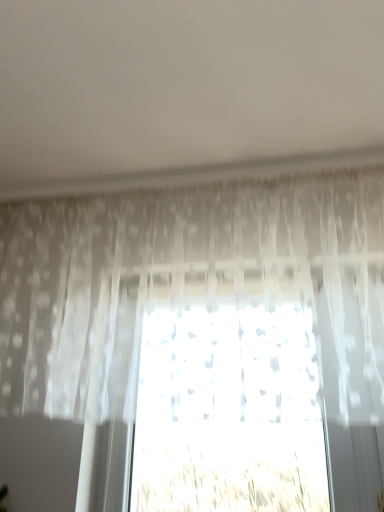
The image size is (384, 512). What do you see at coordinates (188, 283) in the screenshot?
I see `translucent white curtain at center` at bounding box center [188, 283].

You are a GUI agent. You are given a task and a screenshot of the screen. Output one action in this format:
    pyautogui.click(x=<x>, y=<y>)
    Task: Click on the translucent white curtain at center
    This screenshot has height=512, width=384.
    Given the screenshot: What is the action you would take?
    (188, 283)

Measure the distance between translucent fabric plant at center and camera.

translucent fabric plant at center and camera are 3.92 feet apart.

The image size is (384, 512). Find the location of `translucent fabric plant at center`. translucent fabric plant at center is located at coordinates (232, 475).

The height and width of the screenshot is (512, 384). Describe the element at coordinates (232, 475) in the screenshot. I see `translucent fabric plant at center` at that location.

Locate an element on the screen. This screenshot has width=384, height=512. translucent white curtain at center is located at coordinates (188, 283).

Is translucent fabric plant at center to the right of translucent white curtain at center from the viewer's perspective?

Indeed, translucent fabric plant at center is positioned on the right side of translucent white curtain at center.

Is the depth of translucent fabric plant at center less than that of translucent white curtain at center?

No, it is not.

Does point (159, 489) lie behind point (294, 259)?

That is True.

Looking at this image, from the image's perspective, between translucent fabric plant at center and translucent white curtain at center, who is located below?

From the image's view, translucent fabric plant at center is below.

From a real-world perspective, who is located higher, translucent fabric plant at center or translucent white curtain at center?

From a 3D spatial view, translucent white curtain at center is above.

Considering the sizes of translucent fabric plant at center and translucent white curtain at center in the image, is translucent fabric plant at center wider or thinner than translucent white curtain at center?

Considering their sizes, translucent fabric plant at center looks slimmer than translucent white curtain at center.

Between translucent fabric plant at center and translucent white curtain at center, which one has more height?

With more height is translucent white curtain at center.

Considering the relative sizes of translucent fabric plant at center and translucent white curtain at center in the image provided, is translucent fabric plant at center smaller than translucent white curtain at center?

Indeed, translucent fabric plant at center has a smaller size compared to translucent white curtain at center.

Is translucent fabric plant at center inside or outside of translucent white curtain at center?

translucent fabric plant at center exists outside the volume of translucent white curtain at center.

Is translucent fabric plant at center far from translucent white curtain at center?

That's not correct — translucent fabric plant at center is a little close to translucent white curtain at center.

In the scene shown: Could you tell me if translucent fabric plant at center is facing translucent white curtain at center?

No, translucent fabric plant at center is not oriented towards translucent white curtain at center.

You are a GUI agent. You are given a task and a screenshot of the screen. Output one action in this format:
    pyautogui.click(x=<x>, y=<y>)
    Task: Click on the curtain above the translucent fabric plant at center (from the image's perspective)
    
    Given the screenshot: What is the action you would take?
    point(188,283)

Which is more to the right, translucent white curtain at center or translucent fabric plant at center?

translucent fabric plant at center.

Between translucent white curtain at center and translucent fabric plant at center, which one is positioned in front?

translucent white curtain at center is in front.

Is point (105, 341) in front of point (299, 500)?

No, (105, 341) is further to viewer.

From the image's perspective, who appears lower, translucent white curtain at center or translucent fabric plant at center?

translucent fabric plant at center appears lower in the image.

From a real-world perspective, is translucent white curtain at center above or below translucent fabric plant at center?

In terms of real-world spatial position, translucent white curtain at center is above translucent fabric plant at center.

Considering the sizes of translucent white curtain at center and translucent fabric plant at center in the image, is translucent white curtain at center wider or thinner than translucent fabric plant at center?

translucent white curtain at center is wider than translucent fabric plant at center.

From the picture: Is translucent white curtain at center taller than translucent fabric plant at center?

Yes.

Based on their sizes in the image, would you say translucent white curtain at center is bigger or smaller than translucent fabric plant at center?

Considering their sizes, translucent white curtain at center takes up more space than translucent fabric plant at center.

In the scene shown: Would you say translucent white curtain at center is inside or outside translucent fabric plant at center?

translucent white curtain at center is located beyond the bounds of translucent fabric plant at center.

Consider the image. Would you say translucent white curtain at center is a long distance from translucent fabric plant at center?

translucent white curtain at center is near translucent fabric plant at center, not far away.

Is translucent white curtain at center looking in the opposite direction of translucent fabric plant at center?

No, translucent white curtain at center is not facing the opposite direction of translucent fabric plant at center.

What's the angular difference between translucent white curtain at center and translucent fabric plant at center's facing directions?

They differ by 0.00207 degrees in their facing directions.

The width and height of the screenshot is (384, 512). In order to click on curtain that is above the translucent fabric plant at center (from the image's perspective) in this screenshot , I will do `click(188, 283)`.

At what (x,y) coordinates should I click in order to perform the action: click on curtain in front of the translucent fabric plant at center. Please return your answer as a coordinate pair (x, y). The width and height of the screenshot is (384, 512). Looking at the image, I should click on (188, 283).

There is a translucent fabric plant at center. In order to click on curtain above it (from a real-world perspective) in this screenshot , I will do pos(188,283).